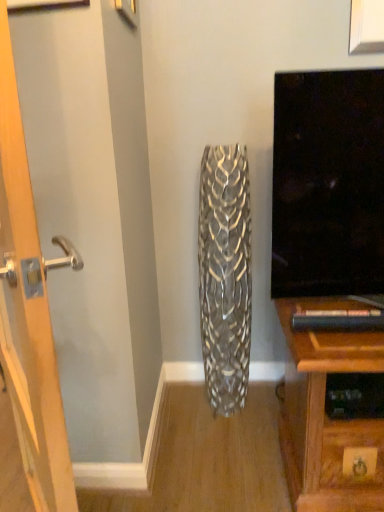
Question: Is silver metallic vase at center at the back of wooden door at left?

Choices:
 (A) no
 (B) yes

Answer: (B)

Question: From a real-world perspective, is wooden door at left physically above silver metallic vase at center?

Choices:
 (A) yes
 (B) no

Answer: (A)

Question: Is wooden door at left touching silver metallic vase at center?

Choices:
 (A) no
 (B) yes

Answer: (A)

Question: Is wooden door at left closer to camera compared to silver metallic vase at center?

Choices:
 (A) no
 (B) yes

Answer: (B)

Question: Would you say wooden door at left is a long distance from silver metallic vase at center?

Choices:
 (A) no
 (B) yes

Answer: (A)

Question: Is wooden door at left wider than silver metallic vase at center?

Choices:
 (A) yes
 (B) no

Answer: (B)

Question: Is silver metallic vase at center bigger than wooden door at left?

Choices:
 (A) yes
 (B) no

Answer: (B)

Question: Considering the relative positions of silver metallic vase at center and wooden door at left in the image provided, is silver metallic vase at center behind wooden door at left?

Choices:
 (A) no
 (B) yes

Answer: (B)

Question: Can you confirm if silver metallic vase at center is smaller than wooden door at left?

Choices:
 (A) no
 (B) yes

Answer: (B)

Question: Is wooden door at left surrounded by silver metallic vase at center?

Choices:
 (A) no
 (B) yes

Answer: (A)

Question: From the image's perspective, would you say silver metallic vase at center is positioned over wooden door at left?

Choices:
 (A) no
 (B) yes

Answer: (B)

Question: Is silver metallic vase at center closer to the viewer compared to wooden door at left?

Choices:
 (A) no
 (B) yes

Answer: (A)

Question: Looking at their shapes, would you say silver metallic vase at center is wider or thinner than wooden door at left?

Choices:
 (A) wide
 (B) thin

Answer: (A)